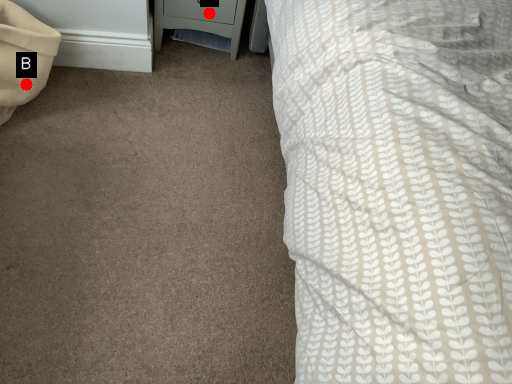
Question: Two points are circled on the image, labeled by A and B beside each circle. Which point is closer to the camera?

Choices:
 (A) A is closer
 (B) B is closer

Answer: (B)